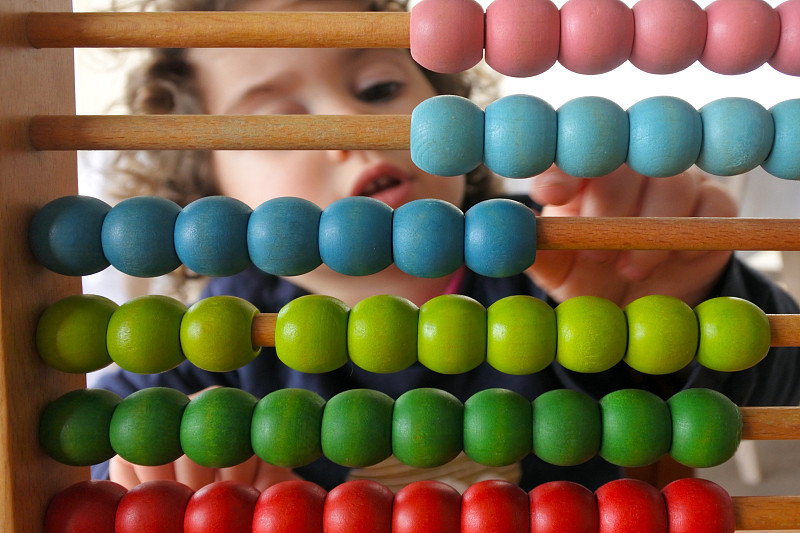
The width and height of the screenshot is (800, 533). I want to click on wooden dowel, so click(x=773, y=510), click(x=774, y=425), click(x=788, y=325), click(x=756, y=230), click(x=348, y=126), click(x=336, y=28).